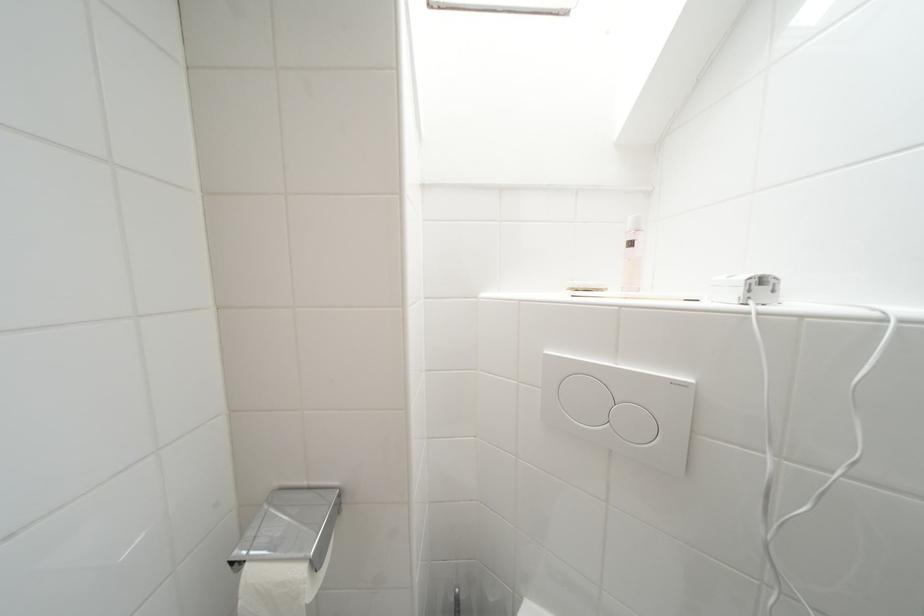
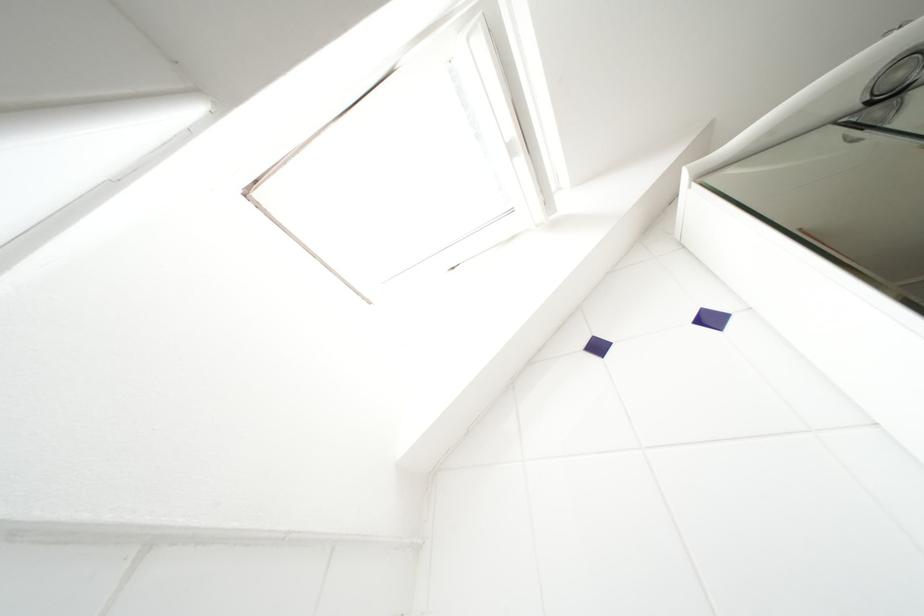
How did the camera likely rotate?

The rotation direction of the camera is right-up.